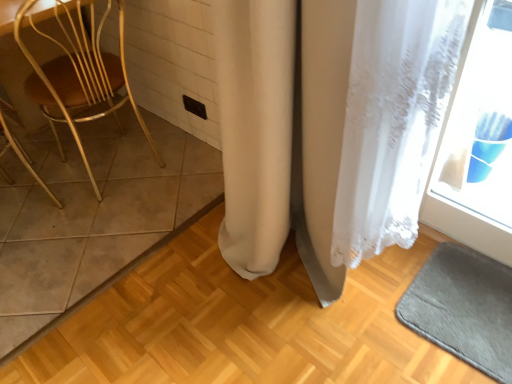
Question: From a real-world perspective, is brown tile at left physically located above or below wooden chair at left?

Choices:
 (A) above
 (B) below

Answer: (B)

Question: Is brown tile at left wider or thinner than wooden chair at left?

Choices:
 (A) thin
 (B) wide

Answer: (B)

Question: Estimate the real-world distances between objects in this image. Which object is closer to the wooden chair at left?

Choices:
 (A) gray soft bath mat at lower right
 (B) white lace curtain at center
 (C) brown tile at left

Answer: (C)

Question: Considering the real-world distances, which object is farthest from the wooden chair at left?

Choices:
 (A) gray soft bath mat at lower right
 (B) brown tile at left
 (C) white lace curtain at center

Answer: (A)